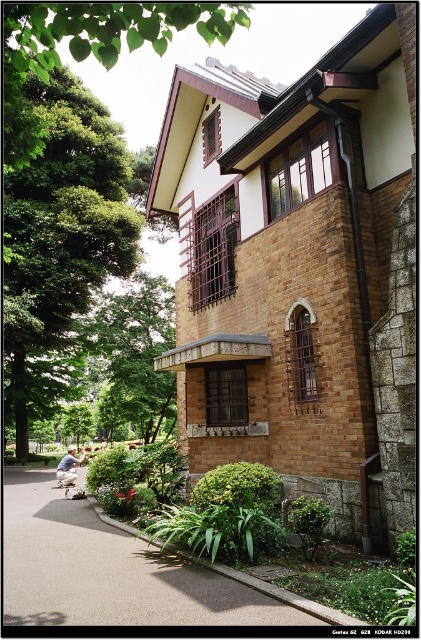
Does point (15, 573) come behind point (88, 326)?

No, it is in front of (88, 326).

The height and width of the screenshot is (640, 421). Describe the element at coordinates (112, 570) in the screenshot. I see `smooth asphalt path at lower left` at that location.

What do you see at coordinates (112, 570) in the screenshot? Image resolution: width=421 pixels, height=640 pixels. I see `smooth asphalt path at lower left` at bounding box center [112, 570].

Locate an element on the screen. smooth asphalt path at lower left is located at coordinates (112, 570).

Can you confirm if green leafy tree at upper left is positioned to the left of stone textured balcony at center?

Yes, green leafy tree at upper left is to the left of stone textured balcony at center.

Can you confirm if green leafy tree at upper left is shorter than stone textured balcony at center?

In fact, green leafy tree at upper left may be taller than stone textured balcony at center.

In order to click on green leafy tree at upper left in this screenshot , I will do `click(104, 29)`.

Identify the location of green leafy tree at upper left. (104, 29).

Does green leafy tree at left appear on the left side of green leafy tree at center?

Incorrect, green leafy tree at left is not on the left side of green leafy tree at center.

Is point (13, 337) in front of point (122, 369)?

Yes, it is in front of point (122, 369).

The height and width of the screenshot is (640, 421). In order to click on green leafy tree at left in this screenshot , I will do `click(63, 234)`.

This screenshot has height=640, width=421. Find the location of `green leafy tree at left`. green leafy tree at left is located at coordinates (63, 234).